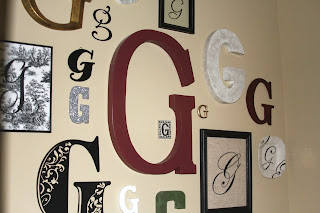
The width and height of the screenshot is (320, 213). What are the coordinates of `frame` in the screenshot? It's located at (229, 133), (181, 26), (49, 80).